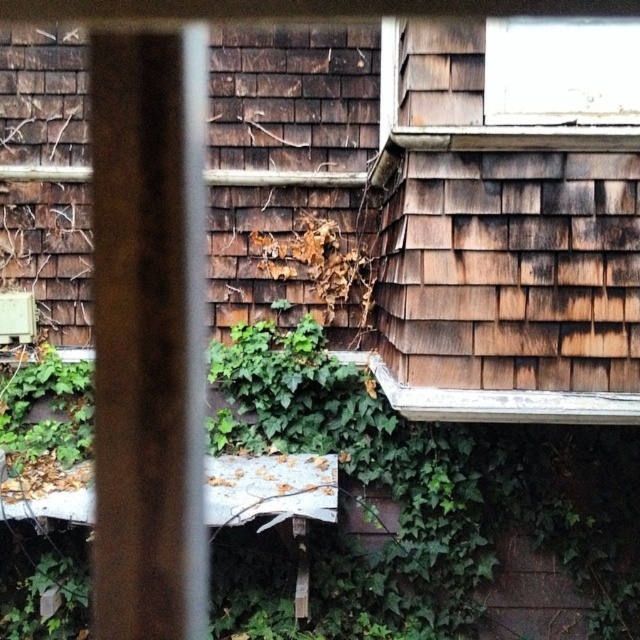
Which is behind, point (483, 97) or point (593, 100)?

Point (483, 97)

Is white painted wood window at upper right bigger than transparent glass window at upper center?

Yes, white painted wood window at upper right is bigger than transparent glass window at upper center.

This screenshot has width=640, height=640. In order to click on white painted wood window at upper right in this screenshot , I will do `click(554, 76)`.